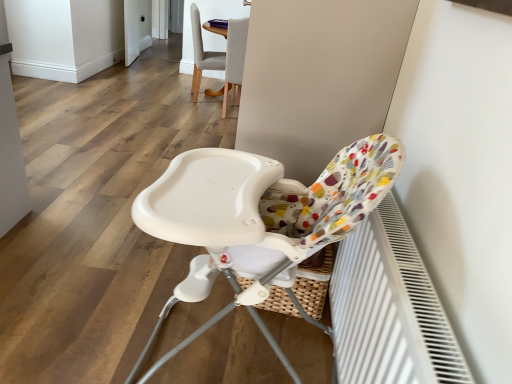
Question: Would you say light gray fabric chair at upper center, the 1th chair viewed from the back, is part of matte gray chair at upper center, which is counted as the 2th chair, starting from the bottom,'s contents?

Choices:
 (A) no
 (B) yes

Answer: (A)

Question: Does matte gray chair at upper center, the 2th chair from the back, have a lesser width compared to light gray fabric chair at upper center, the 3th chair when ordered from bottom to top?

Choices:
 (A) no
 (B) yes

Answer: (B)

Question: Does matte gray chair at upper center, which is counted as the 2th chair, starting from the bottom, have a greater height compared to light gray fabric chair at upper center, the 3th chair when ordered from bottom to top?

Choices:
 (A) yes
 (B) no

Answer: (B)

Question: Does matte gray chair at upper center, which is counted as the 2th chair, starting from the bottom, have a smaller size compared to light gray fabric chair at upper center, which ranks as the 1th chair in top-to-bottom order?

Choices:
 (A) no
 (B) yes

Answer: (B)

Question: Can you confirm if matte gray chair at upper center, the 2th chair in the front-to-back sequence, is shorter than light gray fabric chair at upper center, which ranks as the 1th chair in top-to-bottom order?

Choices:
 (A) no
 (B) yes

Answer: (B)

Question: From the image's perspective, does matte gray chair at upper center, the 2th chair positioned from the top, appear higher than light gray fabric chair at upper center, the 3th chair when ordered from bottom to top?

Choices:
 (A) no
 (B) yes

Answer: (A)

Question: Is white textured radiator at lower right taller than light gray fabric chair at upper center, the 3th chair when ordered from bottom to top?

Choices:
 (A) yes
 (B) no

Answer: (B)

Question: From a real-world perspective, is white textured radiator at lower right over light gray fabric chair at upper center, arranged as the 3th chair when viewed from the front?

Choices:
 (A) yes
 (B) no

Answer: (B)

Question: Is the depth of white textured radiator at lower right less than that of light gray fabric chair at upper center, the 3th chair when ordered from bottom to top?

Choices:
 (A) yes
 (B) no

Answer: (A)

Question: Would you say light gray fabric chair at upper center, the 3th chair when ordered from bottom to top, is part of white textured radiator at lower right's contents?

Choices:
 (A) no
 (B) yes

Answer: (A)

Question: Is white textured radiator at lower right further to the viewer compared to light gray fabric chair at upper center, the 1th chair viewed from the back?

Choices:
 (A) no
 (B) yes

Answer: (A)

Question: From the image's perspective, is white textured radiator at lower right under light gray fabric chair at upper center, the 1th chair viewed from the back?

Choices:
 (A) no
 (B) yes

Answer: (B)

Question: Is white glossy screen door at upper left with white plastic highchair at center, the first chair when ordered from bottom to top?

Choices:
 (A) yes
 (B) no

Answer: (B)